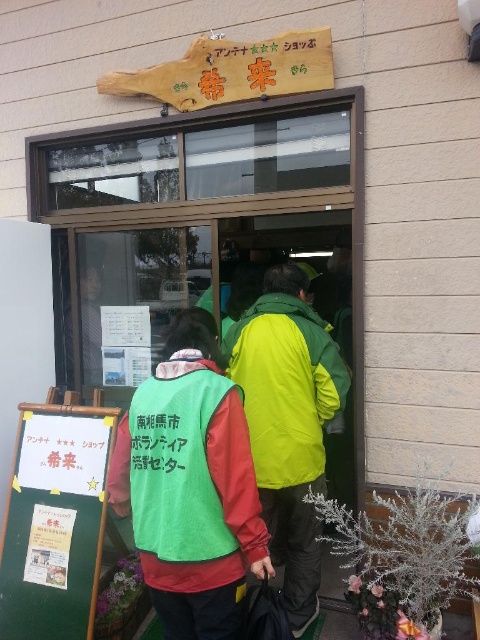
Is green matte jacket at center bigger than green fabric vest at center?

Incorrect, green matte jacket at center is not larger than green fabric vest at center.

Who is more distant from viewer, [290,372] or [118,508]?

The point [290,372] is more distant.

The height and width of the screenshot is (640, 480). Find the location of `green matte jacket at center`. green matte jacket at center is located at coordinates (286, 387).

Is green fabric sign at center thinner than green fabric vest at center?

Yes, green fabric sign at center is thinner than green fabric vest at center.

Consider the image. Between green fabric sign at center and green fabric vest at center, which one is positioned lower?

green fabric sign at center is below.

Where is `green fabric sign at center`? Image resolution: width=480 pixels, height=640 pixels. green fabric sign at center is located at coordinates (55, 522).

This screenshot has width=480, height=640. Find the location of `green fabric sign at center`. green fabric sign at center is located at coordinates (55, 522).

Between green fabric sign at center and green matte jacket at center, which one appears on the left side from the viewer's perspective?

green fabric sign at center is more to the left.

You are a GUI agent. You are given a task and a screenshot of the screen. Output one action in this format:
    pyautogui.click(x=<x>, y=<y>)
    Task: Click on the green fabric sign at center
    The width and height of the screenshot is (480, 640).
    Given the screenshot: What is the action you would take?
    pyautogui.click(x=55, y=522)

You are a GUI agent. You are given a task and a screenshot of the screen. Output one action in this format:
    pyautogui.click(x=<x>, y=<y>)
    Task: Click on the green fabric sign at center
    The height and width of the screenshot is (640, 480).
    Given the screenshot: What is the action you would take?
    pyautogui.click(x=55, y=522)